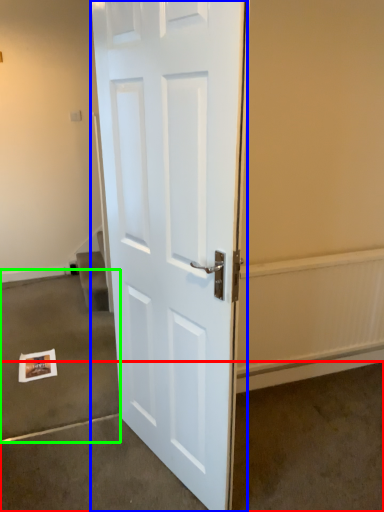
Question: Which is nearer to the concrete (highlighted by a red box)? door (highlighted by a blue box) or concrete (highlighted by a green box).

Choices:
 (A) door
 (B) concrete

Answer: (A)